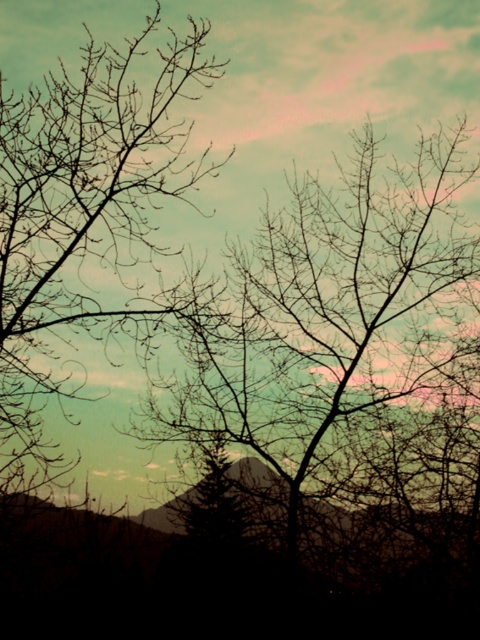
Does silhouette bark tree at upper left have a smaller size compared to silhouette bare branches at left?

No, silhouette bark tree at upper left is not smaller than silhouette bare branches at left.

Is silhouette bark tree at upper left shorter than silhouette bare branches at left?

Incorrect, silhouette bark tree at upper left's height does not fall short of silhouette bare branches at left's.

Does point (443, 326) lie behind point (11, 216)?

Yes, it is behind point (11, 216).

At what (x,y) coordinates should I click in order to perform the action: click on silhouette bark tree at upper left. Please return your answer as a coordinate pair (x, y). Looking at the image, I should click on (345, 339).